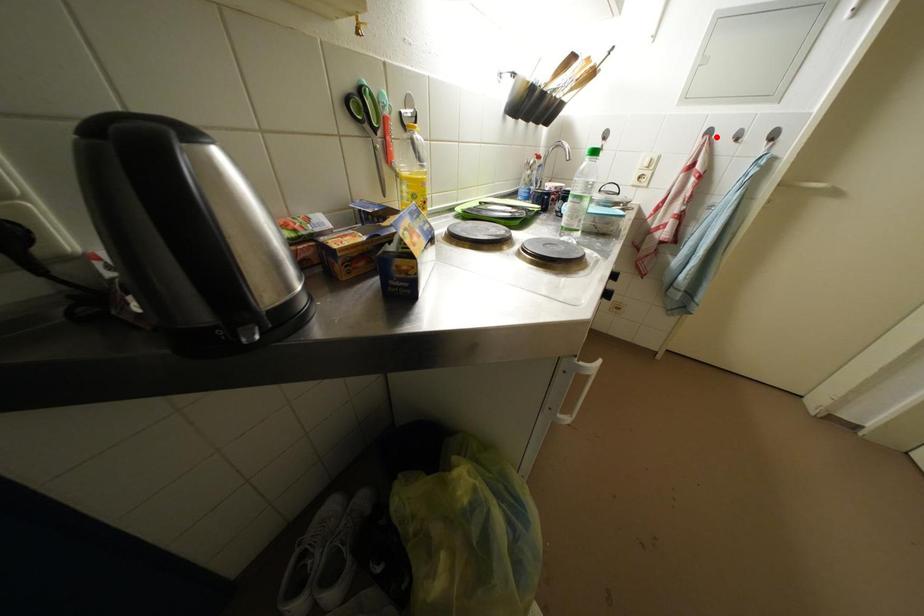
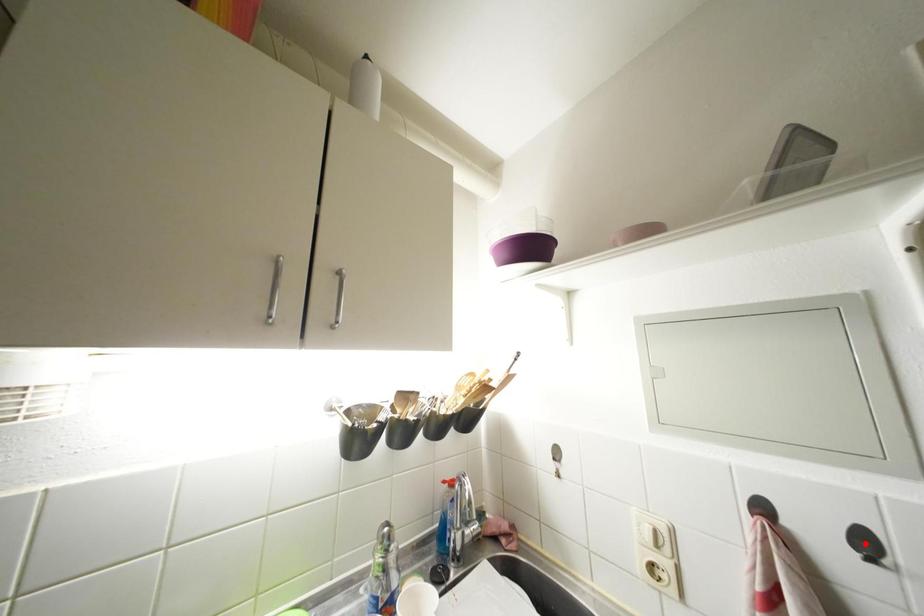
I am providing you with two images of the same scene from different viewpoints. A red point is marked on the first image and another point is marked on the second image. Is the red point in image1 aligned with the point shown in image2?

No